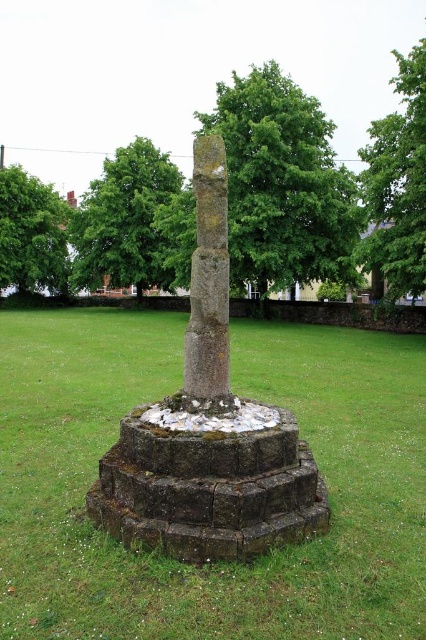
You are a park visitor wanting to take a photo of the monument. You notice two green leafy trees in the image. Which tree, the green leafy tree at center or the green leafy tree at upper center, would block the monument less in your photo?

The green leafy tree at upper center would block the monument less because it is smaller than the green leafy tree at center.

You are planning to plant a new tree in the park. The park has two existing green leafy trees. One is the green leafy tree at center and the other is the green leafy tree at upper left. Which of these two trees is bigger in size?

The green leafy tree at center is bigger in size compared to the green leafy tree at upper left.

You are standing at the edge of the grassy area near the monument and want to take a photo of both the green leafy tree at center and the green leafy tree at upper center. Which tree should you position yourself closer to in order to include both in the frame without cropping either?

Since the green leafy tree at center is much taller than the green leafy tree at upper center, you should position yourself closer to the shorter green leafy tree at upper center to ensure both trees are fully visible in the frame.